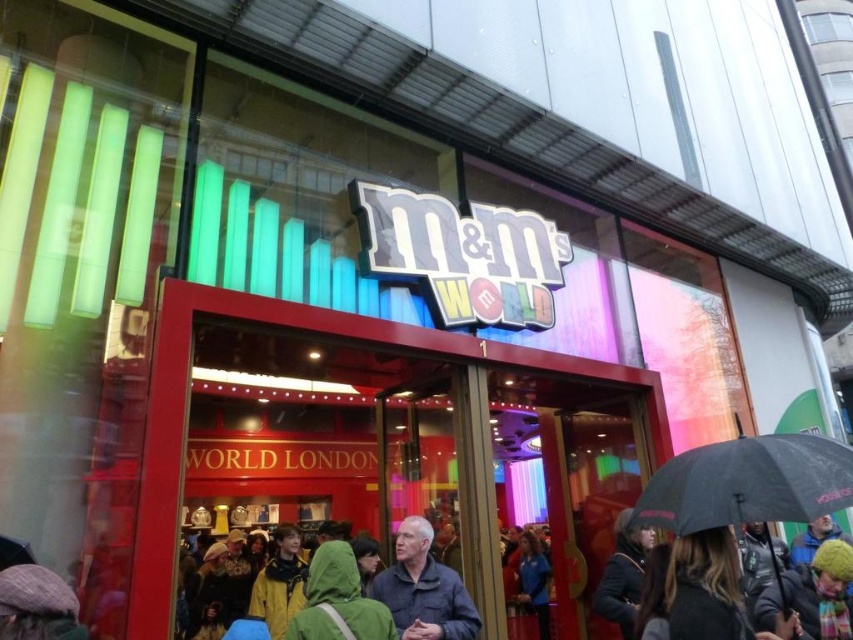
Can you confirm if red plastic sign at center is bigger than black fuzzy hat at lower right?

Yes, red plastic sign at center is bigger than black fuzzy hat at lower right.

Who is higher up, red plastic sign at center or black fuzzy hat at lower right?

red plastic sign at center

Locate an element on the screen. The width and height of the screenshot is (853, 640). red plastic sign at center is located at coordinates (306, 332).

The height and width of the screenshot is (640, 853). Find the location of `red plastic sign at center`. red plastic sign at center is located at coordinates (306, 332).

Which is in front, point (293, 620) or point (633, 552)?

Positioned in front is point (293, 620).

Measure the distance between point (372, 600) and camera.

Point (372, 600) and camera are 2.40 meters apart from each other.

Does point (351, 579) lie behind point (622, 564)?

No, (351, 579) is closer to viewer.

Locate an element on the screen. green matte jacket at center is located at coordinates (338, 600).

How much distance is there between dark blue jacket at center and black fuzzy hat at lower right?

A distance of 37.25 inches exists between dark blue jacket at center and black fuzzy hat at lower right.

Which is below, dark blue jacket at center or black fuzzy hat at lower right?

Positioned lower is black fuzzy hat at lower right.

Identify the location of dark blue jacket at center. (424, 589).